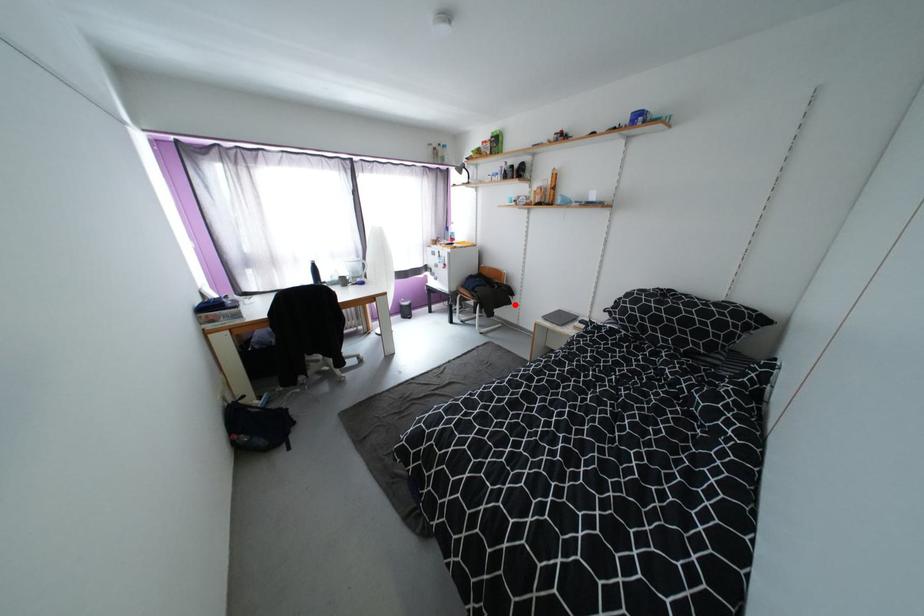
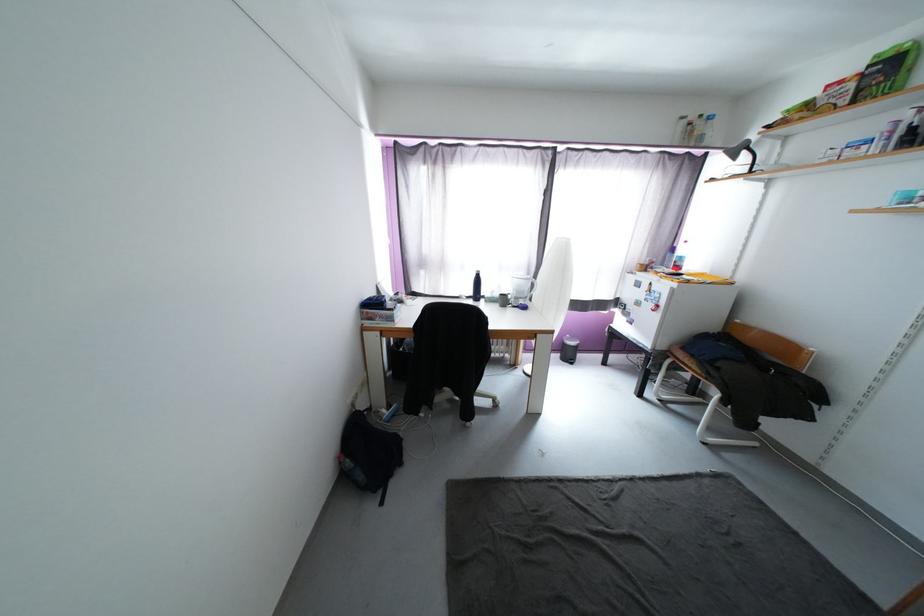
Find the pixel in the second image that matches the highlighted location in the first image.

(812, 419)